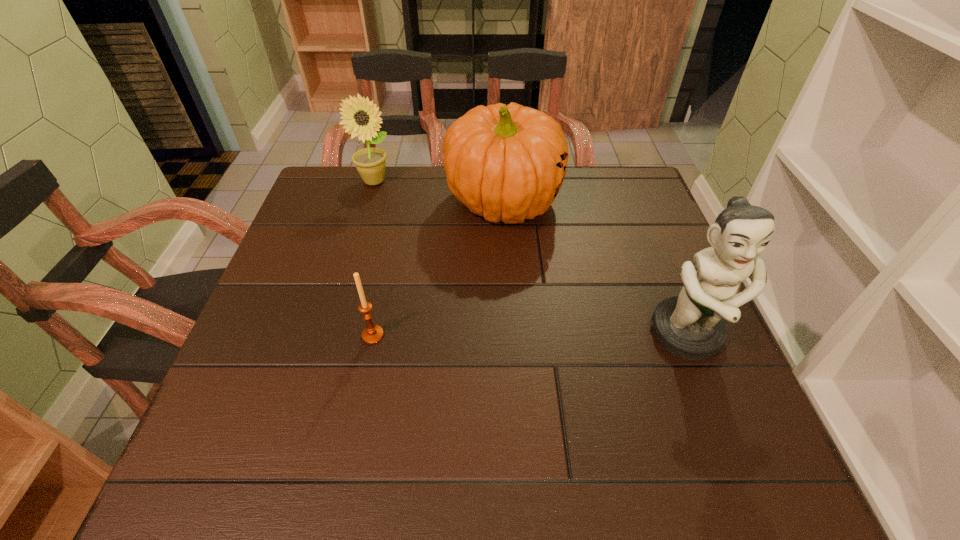
This screenshot has height=540, width=960. Find the location of `vacant point located between the leftmost object and the figurine`. vacant point located between the leftmost object and the figurine is located at coordinates (531, 259).

Where is `blank region between the candle_holder and the rightmost object`? This screenshot has width=960, height=540. blank region between the candle_holder and the rightmost object is located at coordinates (530, 335).

Where is `unoccupied position between the pumpkin and the candle_holder`? Image resolution: width=960 pixels, height=540 pixels. unoccupied position between the pumpkin and the candle_holder is located at coordinates (438, 268).

Identify the location of free point between the pumpkin and the leftmost object. (439, 192).

Identify the location of blank region between the shortest object and the rightmost object. The image size is (960, 540). (530, 335).

Identify which object is the third closest to the sunflower. Please provide its 2D coordinates. Your answer should be formatted as a tuple, i.e. [(x, y)], where the tuple contains the x and y coordinates of a point satisfying the conditions above.

[(691, 326)]

Select which object appears as the closest to the third object from left to right. Please provide its 2D coordinates. Your answer should be formatted as a tuple, i.e. [(x, y)], where the tuple contains the x and y coordinates of a point satisfying the conditions above.

[(361, 117)]